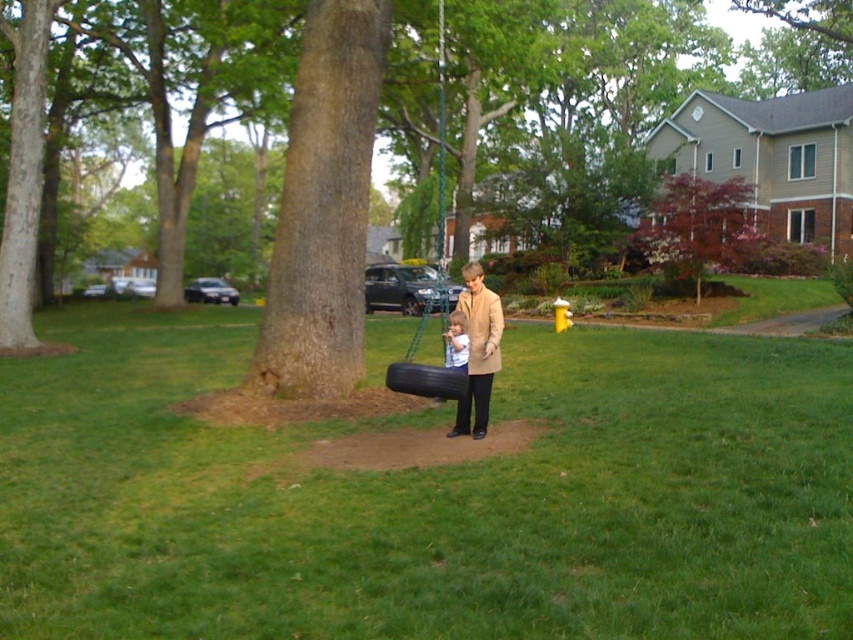
You are a parent trying to ensure safety while your child plays on the black rubber tire swing at center. The tree from which it hangs is the brown rough tree at center. Based on their positions, can you confirm if the swing is properly anchored to the tree?

The black rubber tire swing at center is located below brown rough tree at center, which means it is properly anchored to the tree as it is positioned directly underneath it.

You are a photographer trying to capture a photo of the brown rough tree at center and the beige wool coat at center. Based on their positions, which object should you adjust your camera to focus on first if you want to include both in the frame without moving the camera?

The beige wool coat at center is on the left side of the brown rough tree at center, so you should focus on the beige wool coat at center first to ensure both are in the frame without moving the camera.